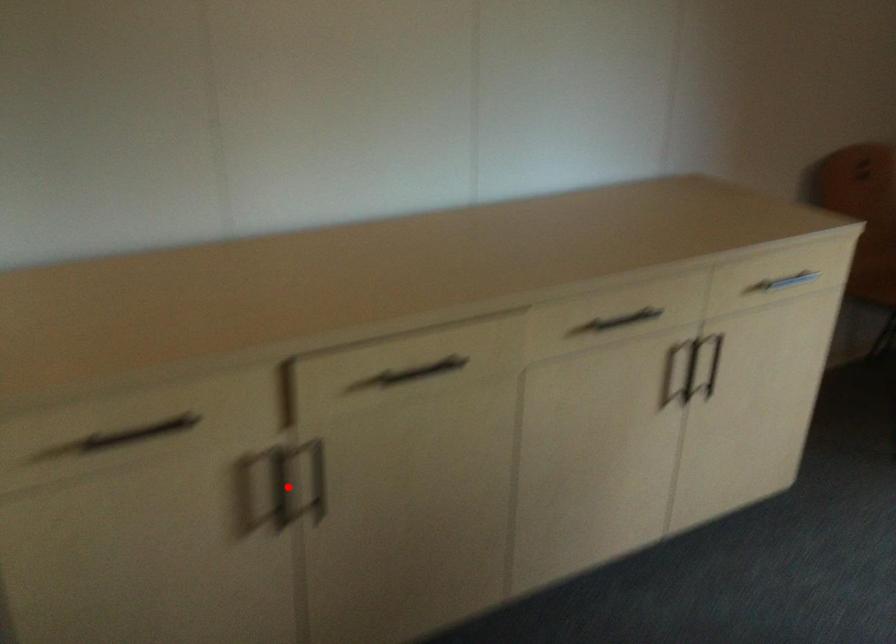
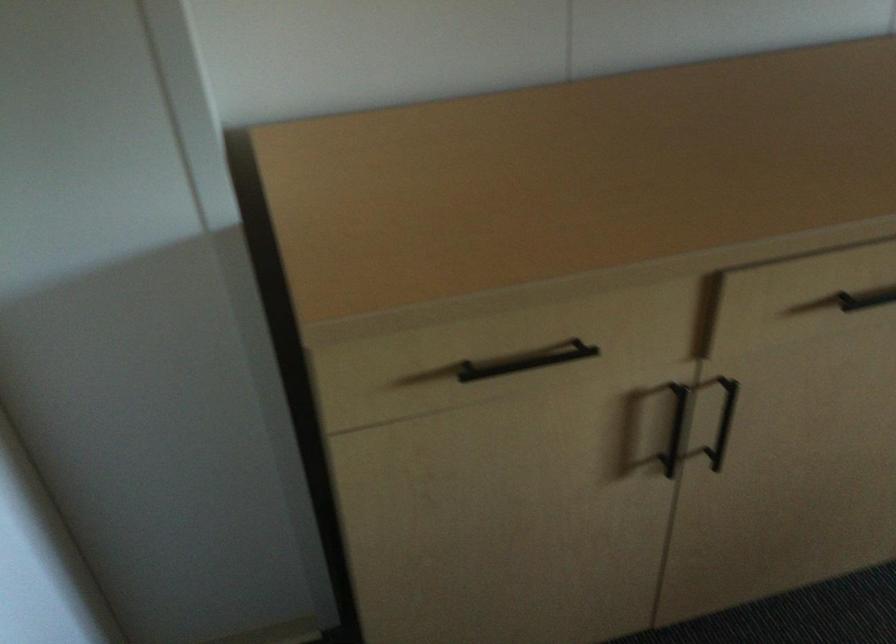
Question: I am providing you with two images of the same scene from different viewpoints. Image1 has a red point marked. In image2, the corresponding 3D location appears at what relative position? Reply with the corresponding letter.

Choices:
 (A) Closer
 (B) Farther

Answer: (A)